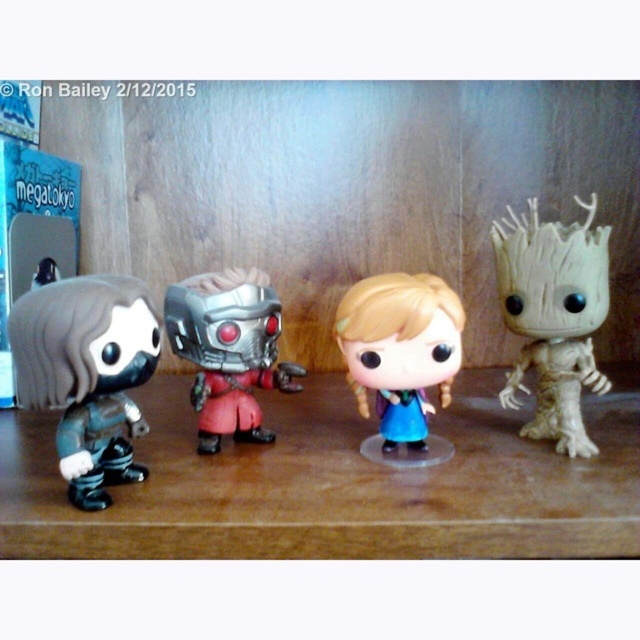
You are a collector arranging Funko Pop figurines on a shelf. You have a matte black figure at left and a metallic silver robot at center. Which figurine is positioned closer to the front of the shelf?

The matte black figure at left is closer to the viewer than the metallic silver robot at center, so it is positioned closer to the front of the shelf.